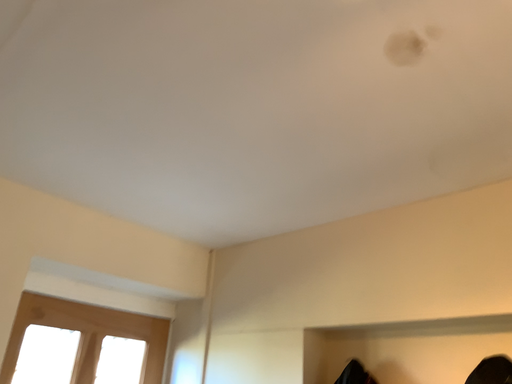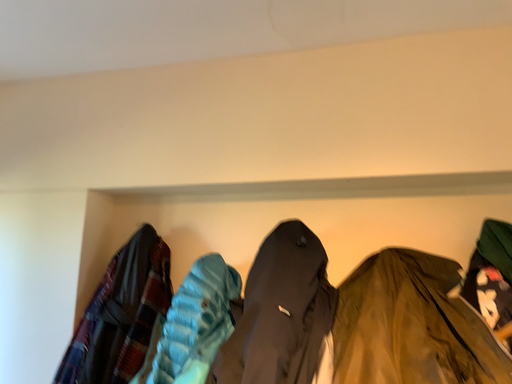
Question: How did the camera likely rotate when shooting the video?

Choices:
 (A) rotated left
 (B) rotated right

Answer: (B)